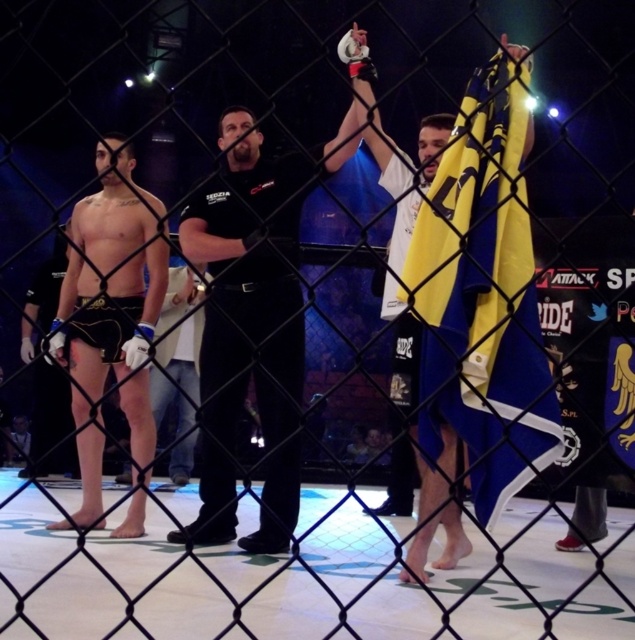
Is black matte referee at center closer to the viewer compared to matte black shorts at center?

No, black matte referee at center is further to the viewer.

Is point (224, 177) more distant than point (149, 332)?

That is True.

Measure the distance between black matte referee at center and camera.

The distance of black matte referee at center from camera is 3.79 feet.

Where is `black matte referee at center`? This screenshot has height=640, width=635. black matte referee at center is located at coordinates (251, 321).